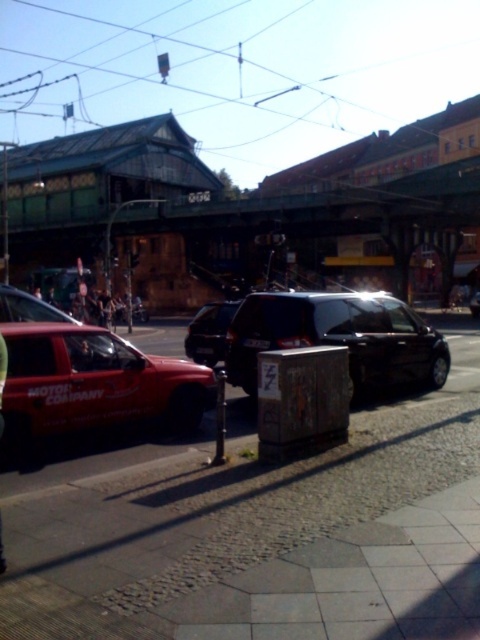
You are standing on the sidewalk in the urban street scene. There are two points marked in the image. The first point is at coordinates point (228, 316) and the second is at point (1, 420). Which point is closer to you?

Point (228, 316) is closer to you because it is further to the viewer than point (1, 420).

You are standing at the edge of the sidewalk in the urban street scene. If you face the cobblestone pavement at center, which direction should you walk to reach it?

The cobblestone pavement at center is located at point 0.830 on the x and 0.535 on the y coordinates. Since you are at the edge of the sidewalk, you should walk forward towards the center of the scene to reach it.